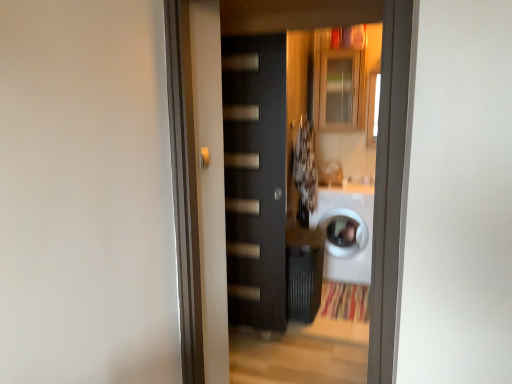
Find the location of `white glossy washing machine at center`. white glossy washing machine at center is located at coordinates (343, 232).

Where is `matte black door at center`? This screenshot has width=512, height=384. matte black door at center is located at coordinates (255, 178).

The image size is (512, 384). What do you see at coordinates (204, 157) in the screenshot? I see `matte black door handle at center` at bounding box center [204, 157].

Image resolution: width=512 pixels, height=384 pixels. Identify the location of white glossy washing machine at center. (343, 232).

Is fluffy white laundry at center next to white glossy washing machine at center?

No.

Is fluffy white laundry at center to the left or to the right of white glossy washing machine at center in the image?

From the image, it's evident that fluffy white laundry at center is to the left of white glossy washing machine at center.

Considering the sizes of objects fluffy white laundry at center and white glossy washing machine at center in the image provided, who is bigger, fluffy white laundry at center or white glossy washing machine at center?

white glossy washing machine at center.

Is fluffy white laundry at center far away from matte glass cabinet at upper center?

No, there isn't a large distance between fluffy white laundry at center and matte glass cabinet at upper center.

How many degrees apart are the facing directions of fluffy white laundry at center and matte glass cabinet at upper center?

90 degrees separate the facing orientations of fluffy white laundry at center and matte glass cabinet at upper center.

Considering the positions of objects fluffy white laundry at center and matte glass cabinet at upper center in the image provided, who is behind, fluffy white laundry at center or matte glass cabinet at upper center?

matte glass cabinet at upper center is more distant.

Is point (304, 213) closer to viewer compared to point (338, 130)?

Yes, it is in front of point (338, 130).

From the picture: Who is shorter, matte black door at center or matte glass cabinet at upper center?

matte glass cabinet at upper center.

Is matte black door at center looking in the opposite direction of matte glass cabinet at upper center?

That's right, matte black door at center is facing away from matte glass cabinet at upper center.

Which of these two, matte black door at center or matte glass cabinet at upper center, is smaller?

With smaller size is matte glass cabinet at upper center.

Would you say matte black door at center is to the left or to the right of matte glass cabinet at upper center in the picture?

matte black door at center is to the left of matte glass cabinet at upper center.

Is matte black door handle at center next to white glossy washing machine at center?

No, matte black door handle at center is not next to white glossy washing machine at center.

Based on the photo, considering the positions of objects matte black door handle at center and white glossy washing machine at center in the image provided, who is more to the right, matte black door handle at center or white glossy washing machine at center?

From the viewer's perspective, white glossy washing machine at center appears more on the right side.

Does point (201, 163) appear closer or farther from the camera than point (336, 251)?

Point (201, 163) is closer to the camera than point (336, 251).

Can you confirm if matte black door handle at center is thinner than white glossy washing machine at center?

Correct, the width of matte black door handle at center is less than that of white glossy washing machine at center.

From a real-world perspective, which is physically above, matte black door at center or matte black door handle at center?

matte black door handle at center.

Which object is further away from the camera taking this photo, matte black door at center or matte black door handle at center?

matte black door at center is more distant.

Between matte black door at center and matte black door handle at center, which one has larger size?

With larger size is matte black door at center.

Between matte black door at center and matte black door handle at center, which one has larger width?

With larger width is matte black door at center.

Can you confirm if fluffy white laundry at center is wider than matte black door at center?

Correct, the width of fluffy white laundry at center exceeds that of matte black door at center.

Looking at this image, is fluffy white laundry at center turned away from matte black door at center?

fluffy white laundry at center does not have its back to matte black door at center.

From a real-world perspective, does fluffy white laundry at center sit lower than matte black door at center?

Actually, fluffy white laundry at center is physically above matte black door at center in the real world.

In the scene shown: Which of these two, fluffy white laundry at center or matte black door at center, is bigger?

With larger size is matte black door at center.

Considering the sizes of objects matte black door handle at center and matte glass cabinet at upper center in the image provided, who is bigger, matte black door handle at center or matte glass cabinet at upper center?

Bigger between the two is matte glass cabinet at upper center.

Is matte black door handle at center aimed at matte glass cabinet at upper center?

No.

From the image's perspective, is matte black door handle at center located beneath matte glass cabinet at upper center?

Yes, from the image's perspective, matte black door handle at center is below matte glass cabinet at upper center.

How different are the orientations of matte black door handle at center and matte glass cabinet at upper center in degrees?

matte black door handle at center and matte glass cabinet at upper center are facing 89.3 degrees away from each other.

Image resolution: width=512 pixels, height=384 pixels. What are the coordinates of `laundry on the left of white glossy washing machine at center` in the screenshot? It's located at (305, 171).

Image resolution: width=512 pixels, height=384 pixels. I want to click on laundry that appears in front of the matte glass cabinet at upper center, so click(305, 171).

When comparing their distances from white glossy washing machine at center, does matte glass cabinet at upper center or fluffy white laundry at center seem closer?

fluffy white laundry at center is closer to white glossy washing machine at center.

Estimate the real-world distances between objects in this image. Which object is closer to matte black door handle at center, matte glass cabinet at upper center or white glossy washing machine at center?

Based on the image, white glossy washing machine at center appears to be nearer to matte black door handle at center.

Estimate the real-world distances between objects in this image. Which object is further from matte black door at center, matte black door handle at center or fluffy white laundry at center?

The object further to matte black door at center is matte black door handle at center.

From the image, which object appears to be farther from matte glass cabinet at upper center, matte black door at center or matte black door handle at center?

matte black door handle at center lies further to matte glass cabinet at upper center than the other object.

Looking at the image, which one is located further to matte black door at center, fluffy white laundry at center or white glossy washing machine at center?

The object further to matte black door at center is white glossy washing machine at center.

When comparing their distances from matte black door at center, does matte glass cabinet at upper center or matte black door handle at center seem closer?

matte black door handle at center is closer to matte black door at center.

Estimate the real-world distances between objects in this image. Which object is closer to matte black door handle at center, white glossy washing machine at center or matte black door at center?

→ The object closer to matte black door handle at center is matte black door at center.

Which object lies further to the anchor point fluffy white laundry at center, matte glass cabinet at upper center or white glossy washing machine at center?

matte glass cabinet at upper center lies further to fluffy white laundry at center than the other object.

This screenshot has width=512, height=384. I want to click on laundry between matte black door at center and white glossy washing machine at center along the z-axis, so click(x=305, y=171).

In order to click on door located between matte black door handle at center and matte glass cabinet at upper center in the depth direction in this screenshot , I will do `click(255, 178)`.

Find the location of a particular element. door located between matte black door handle at center and fluffy white laundry at center in the depth direction is located at coordinates click(x=255, y=178).

Image resolution: width=512 pixels, height=384 pixels. I want to click on door located between matte black door handle at center and white glossy washing machine at center in the depth direction, so click(x=255, y=178).